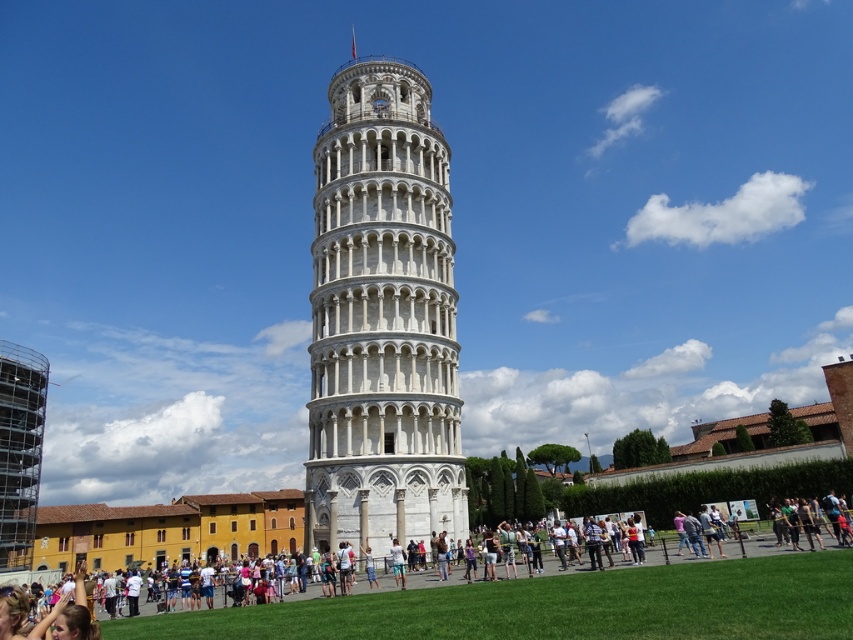
You are standing at the base of the Leaning Tower of Pisa and notice two points marked on the tower. One is at coordinate point (437,368) and the other at point (761,570). From your perspective, which point is closer to the front of the tower?

Point (761,570) is closer to the front of the tower because point (437,368) is behind it.

You are a tourist standing at the camera position, and you want to take a photo of the white marble tower at center. The park ranger says that the closest you can get to the tower is 100 feet. Can you take the photo from your current position without moving closer?

The white marble tower at center is 121.55 feet away from your current position, which is beyond the 100 feet minimum distance requirement. Therefore, you can take the photo from here without moving closer.

Looking at this image, you are a tourist visiting the Leaning Tower of Pisa and want to take a photo that includes both the white marble tower at center and the white stone tower at center. Which tower should you focus on to ensure both are in the frame without zooming in or out?

You should focus on the white marble tower at center because it is larger in size compared to the white stone tower at center, making it easier to include both in the frame without adjusting the zoom.